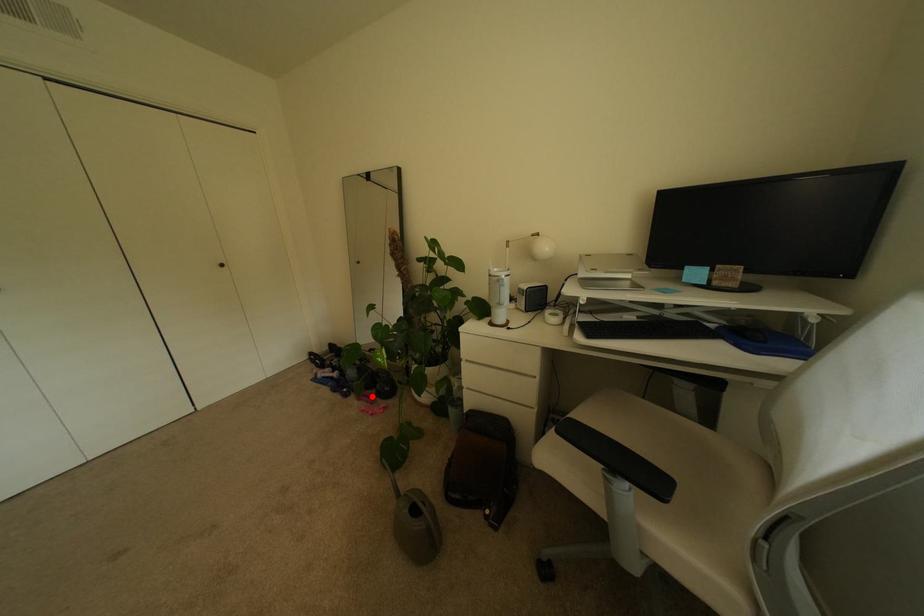
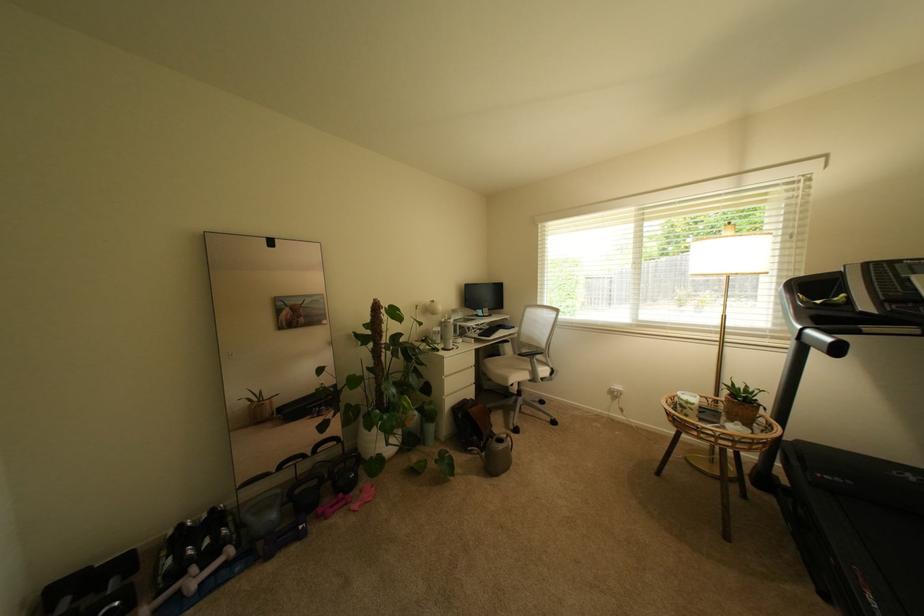
Question: I am providing you with two images of the same scene from different viewpoints. A red point is shown in image1. For the corresponding object point in image2, is it positioned nearer or farther from the camera?

Choices:
 (A) Nearer
 (B) Farther

Answer: (A)